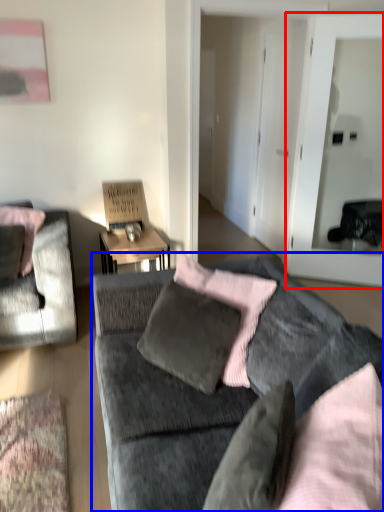
Question: Among these objects, which one is nearest to the camera, glass door (highlighted by a red box) or studio couch (highlighted by a blue box)?

Choices:
 (A) glass door
 (B) studio couch

Answer: (B)